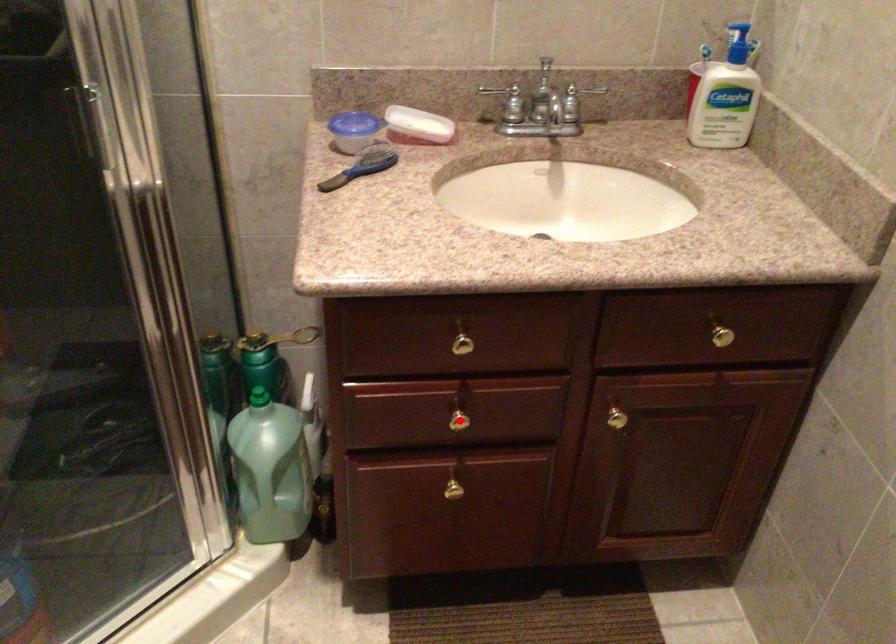
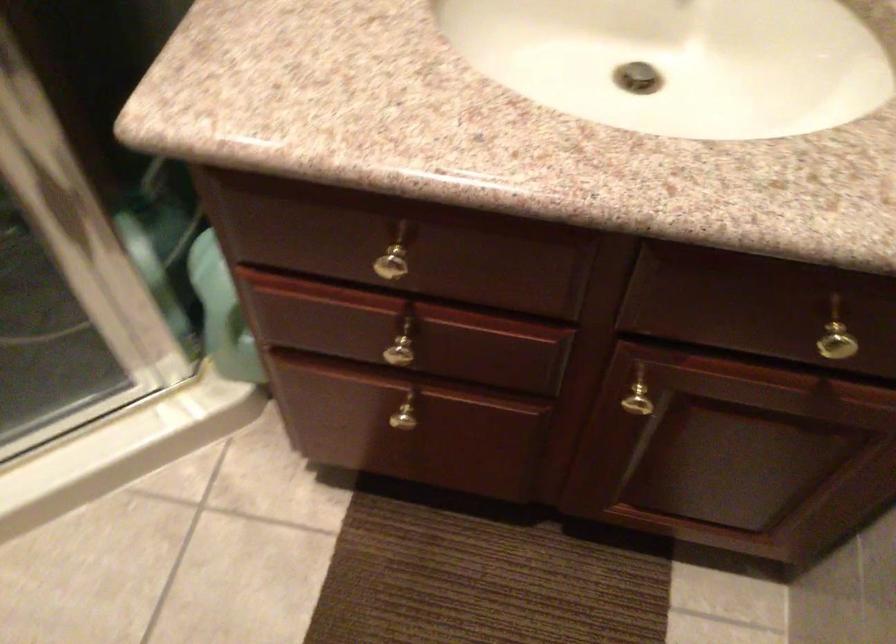
The point at the highlighted location is marked in the first image. Where is the corresponding point in the second image?

(401, 354)